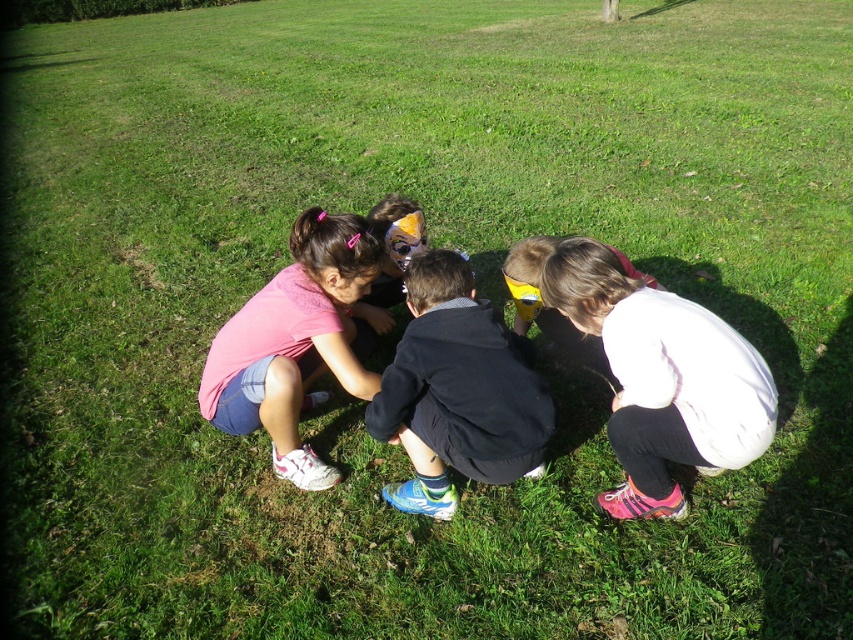
What is the position of the white matte jacket at lower right in the image coordinates?

The white matte jacket at lower right is located at point (662, 378) in the image coordinates.

You are a photographer trying to capture a group shot of the children. The children are currently crouching 8.10 feet apart. If you want to position them closer to each other for the photo, which child should move towards the white matte jacket at lower right?

The child on the left should move towards the white matte jacket at lower right to reduce the distance between them.

You are a photographer trying to capture a photo of the children. You want to ensure that both the black matte jacket at center and the pink fabric shirt at center are visible in the frame. Based on their positions, which child should be positioned closer to the left side of the photo?

The pink fabric shirt at center should be positioned closer to the left side of the photo because the black matte jacket at center is to the right of it.